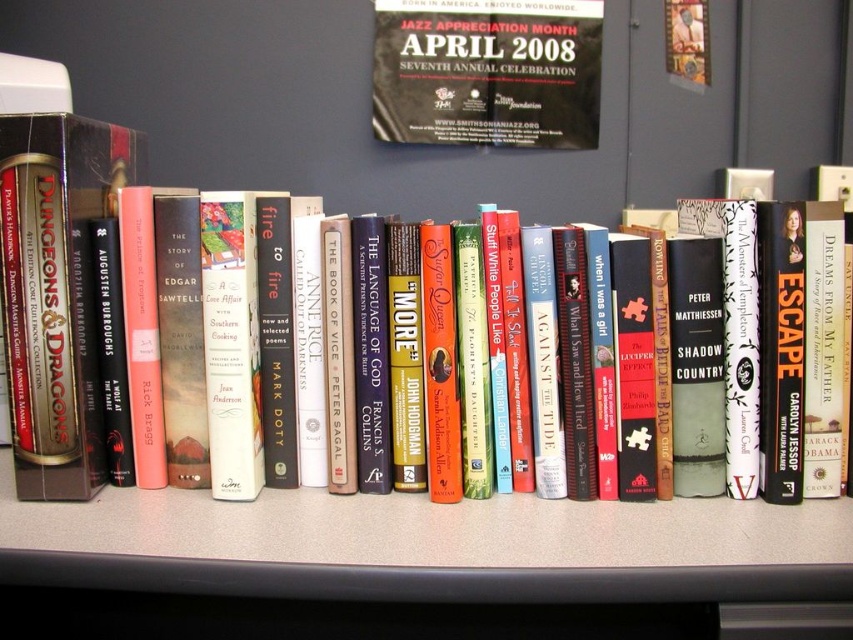
You are a student who needs to place a 50 cm textbook on a surface. You are standing in front of the gray laminate table at center. Can you place the textbook on the table?

The gray laminate table at center and viewer are 57.56 centimeters apart, so yes, the student can place the 50 cm textbook on the table since the distance is sufficient.

You are organizing a bookshelf and notice the gray laminate table at center and the hardcover book at center. Which object is located to the right of the other?

The gray laminate table at center is positioned on the right side of the hardcover book at center, so it is to the right of the hardcover book at center.

Based on the photo, you are standing in front of the bookshelf and want to reach two points on the shelf. One is at point coordinates point (717, 563) and the other is at point coordinates point (242, 316). Which point is easier to reach without moving your position?

Point (717, 563) is closer to the camera than point (242, 316), so it is easier to reach without moving your position.